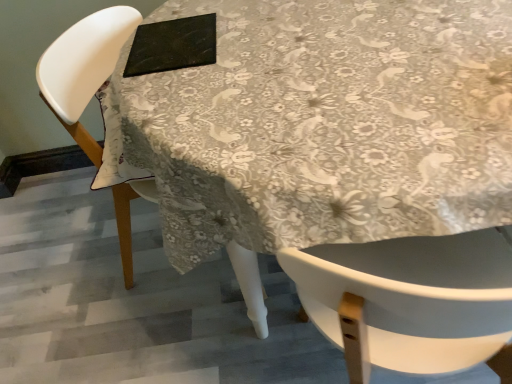
This screenshot has height=384, width=512. What do you see at coordinates (172, 45) in the screenshot?
I see `black matte pad at upper center` at bounding box center [172, 45].

Measure the distance between point [177,36] and camera.

The distance of point [177,36] from camera is 3.36 feet.

Identify the location of black matte pad at upper center. (172, 45).

Considering the positions of point (165, 9) and point (248, 253), is point (165, 9) closer or farther from the camera than point (248, 253)?

Point (165, 9) is farther from the camera than point (248, 253).

This screenshot has height=384, width=512. Find the location of `table lying above the white plastic chair at upper left (from the image's perspective)`. table lying above the white plastic chair at upper left (from the image's perspective) is located at coordinates (320, 128).

How many degrees apart are the facing directions of white glossy table at center and white plastic chair at upper left?

The angle between the facing direction of white glossy table at center and the facing direction of white plastic chair at upper left is 82.9 degrees.

Is the depth of white glossy table at center greater than that of white plastic chair at upper left?

No, it is not.

Does white glossy table at center have a smaller size compared to black matte pad at upper center?

Incorrect, white glossy table at center is not smaller in size than black matte pad at upper center.

In terms of width, does white glossy table at center look wider or thinner when compared to black matte pad at upper center?

Clearly, white glossy table at center has more width compared to black matte pad at upper center.

This screenshot has width=512, height=384. Find the location of `table on the right of the black matte pad at upper center`. table on the right of the black matte pad at upper center is located at coordinates (320, 128).

Could you tell me if white glossy table at center is facing black matte pad at upper center?

No.

Is white plastic chair at upper left shorter than white glossy table at center?

Correct, white plastic chair at upper left is not as tall as white glossy table at center.

From the image's perspective, which is below, white plastic chair at upper left or white glossy table at center?

From the image's view, white plastic chair at upper left is below.

In the scene shown: From a real-world perspective, is white plastic chair at upper left positioned under white glossy table at center based on gravity?

Actually, white plastic chair at upper left is physically above white glossy table at center in the real world.

From a real-world perspective, is black matte pad at upper center under white glossy table at center?

Actually, black matte pad at upper center is physically above white glossy table at center in the real world.

Is black matte pad at upper center placed right next to white glossy table at center?

No, black matte pad at upper center is not touching white glossy table at center.

Considering the relative sizes of black matte pad at upper center and white glossy table at center in the image provided, is black matte pad at upper center bigger than white glossy table at center?

Actually, black matte pad at upper center might be smaller than white glossy table at center.

Considering the relative positions of white plastic chair at upper left and black matte pad at upper center in the image provided, is white plastic chair at upper left in front of black matte pad at upper center?

Yes, it is.

How different are the orientations of white plastic chair at upper left and black matte pad at upper center in degrees?

The angle between the facing direction of white plastic chair at upper left and the facing direction of black matte pad at upper center is 7.11 degrees.

Is black matte pad at upper center at the back of white plastic chair at upper left?

That's not correct — white plastic chair at upper left is not looking away from black matte pad at upper center.

Between point (126, 74) and point (71, 128), which one is positioned behind?

Point (71, 128)

From a real-world perspective, which is physically above, black matte pad at upper center or white plastic chair at upper left?

black matte pad at upper center.

Is black matte pad at upper center facing towards white plastic chair at upper left?

Yes, black matte pad at upper center is oriented towards white plastic chair at upper left.

Is black matte pad at upper center taller than white plastic chair at upper left?

No.

Identify the location of chair behind the white glossy table at center. (84, 68).

At what (x,y) coordinates should I click in order to perform the action: click on table in front of the black matte pad at upper center. Please return your answer as a coordinate pair (x, y). Image resolution: width=512 pixels, height=384 pixels. Looking at the image, I should click on (320, 128).

Looking at the image, which one is located further to white glossy table at center, white plastic chair at upper left or black matte pad at upper center?

white plastic chair at upper left is positioned further to the anchor white glossy table at center.

Looking at the image, which one is located closer to black matte pad at upper center, white plastic chair at upper left or white glossy table at center?

The object closer to black matte pad at upper center is white glossy table at center.

Looking at this image, from the image, which object appears to be farther from white plastic chair at upper left, black matte pad at upper center or white glossy table at center?

white glossy table at center lies further to white plastic chair at upper left than the other object.

Looking at the image, which one is located closer to white glossy table at center, black matte pad at upper center or white plastic chair at upper left?

black matte pad at upper center lies closer to white glossy table at center than the other object.

From the image, which object appears to be farther from white plastic chair at upper left, white glossy table at center or black matte pad at upper center?

The object further to white plastic chair at upper left is white glossy table at center.

When comparing their distances from black matte pad at upper center, does white glossy table at center or white plastic chair at upper left seem further?

The object further to black matte pad at upper center is white plastic chair at upper left.

Locate an element on the screen. The width and height of the screenshot is (512, 384). pad between white plastic chair at upper left and white glossy table at center from left to right is located at coordinates (172, 45).